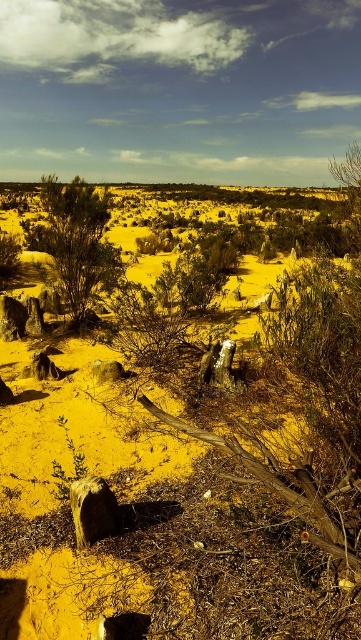
Question: Is desert sand at center to the right of green matte bush at upper left from the viewer's perspective?

Choices:
 (A) yes
 (B) no

Answer: (A)

Question: In this image, where is desert sand at center located relative to green matte bush at upper left?

Choices:
 (A) above
 (B) below

Answer: (B)

Question: Among these objects, which one is farthest from the camera?

Choices:
 (A) desert sand at center
 (B) green matte bush at upper left

Answer: (B)

Question: Is desert sand at center thinner than green matte bush at upper left?

Choices:
 (A) no
 (B) yes

Answer: (B)

Question: Which point is closer to the camera taking this photo?

Choices:
 (A) (105, 212)
 (B) (249, 440)

Answer: (B)